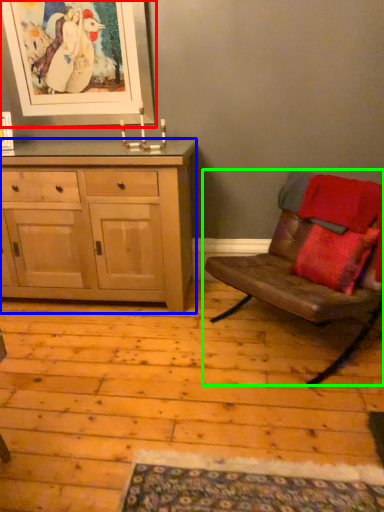
Question: Estimate the real-world distances between objects in this image. Which object is farther from picture frame (highlighted by a red box), cabinetry (highlighted by a blue box) or chair (highlighted by a green box)?

Choices:
 (A) cabinetry
 (B) chair

Answer: (B)